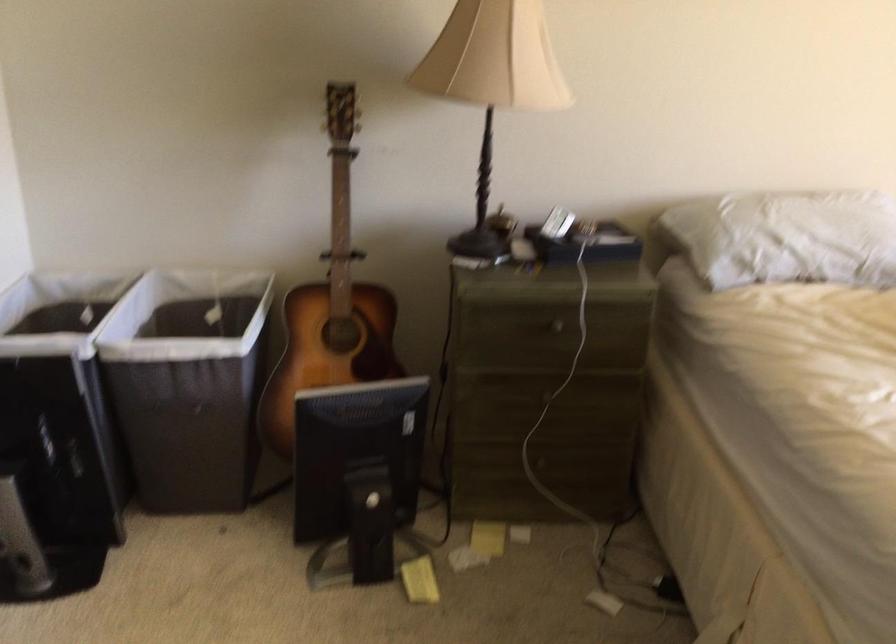
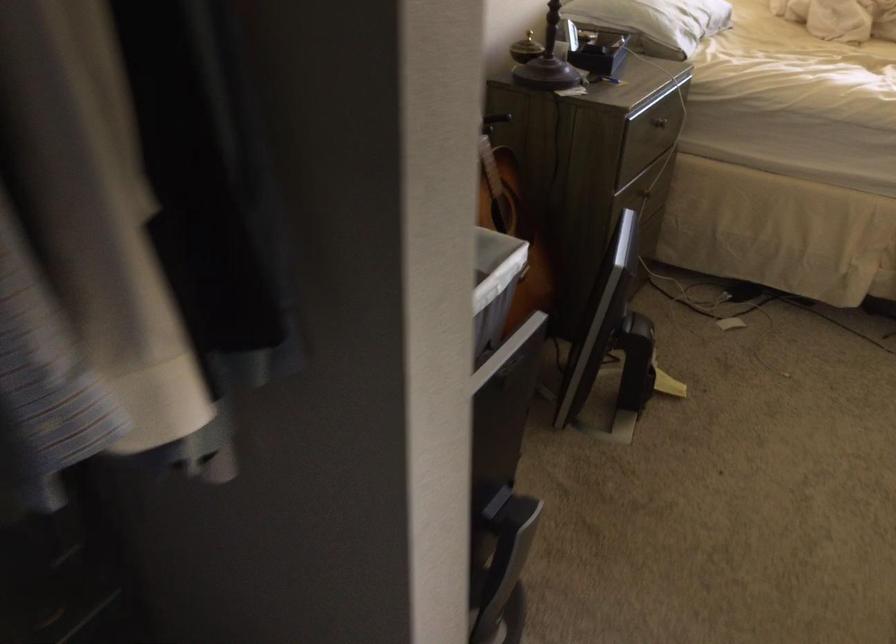
Question: I am providing you with two images of the same scene from different viewpoints. Please identify which objects are invisible in image2.

Choices:
 (A) red luggage tag
 (B) white hamper
 (C) white pillow
 (D) grey laundry hamper

Answer: (D)